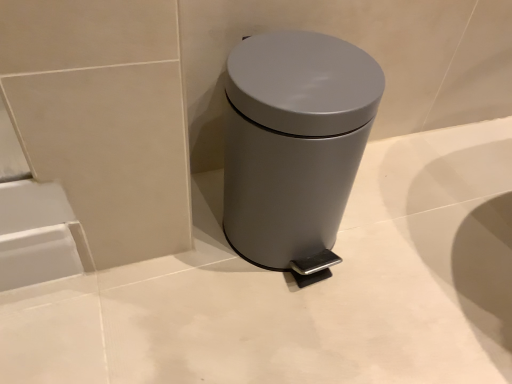
In order to face satin silver trash can at center, should I rotate leftwards or rightwards?

It's best to rotate right around 5.615 degrees.

Describe the element at coordinates (294, 146) in the screenshot. The image size is (512, 384). I see `satin silver trash can at center` at that location.

I want to click on satin silver trash can at center, so click(294, 146).

Measure the distance between satin silver trash can at center and camera.

satin silver trash can at center is 15.68 inches from camera.

The image size is (512, 384). I want to click on satin silver trash can at center, so click(294, 146).